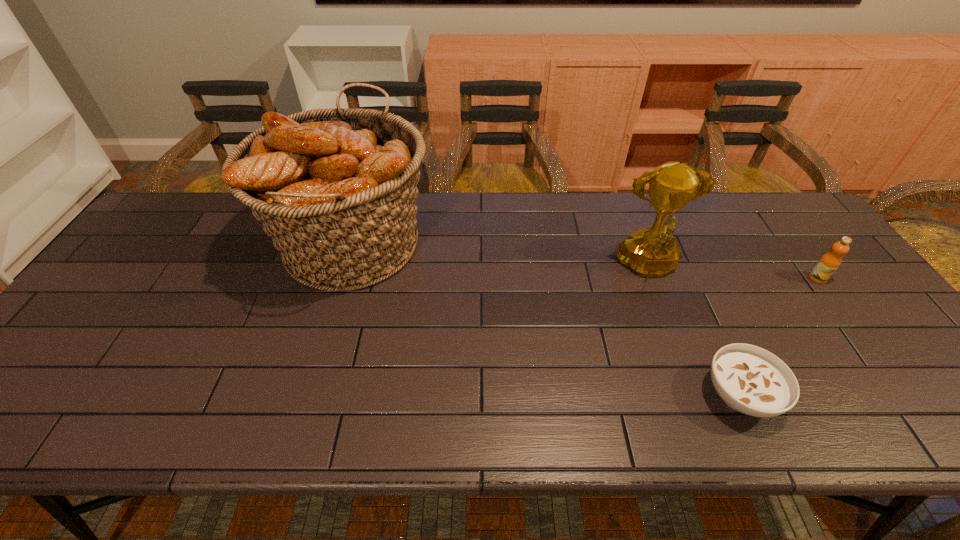
Identify the location of free point between the leftmost object and the orange juice. This screenshot has width=960, height=540. (585, 261).

Locate an element on the screen. Image resolution: width=960 pixels, height=540 pixels. vacant space that is in between the rightmost object and the basket is located at coordinates (585, 261).

At what (x,y) coordinates should I click in order to perform the action: click on vacant space in between the shortest object and the rightmost object. Please return your answer as a coordinate pair (x, y). Looking at the image, I should click on (779, 336).

Where is `vacant space in between the nearest object and the third tallest object`? vacant space in between the nearest object and the third tallest object is located at coordinates (779, 336).

Locate an element on the screen. This screenshot has width=960, height=540. free space between the third shortest object and the soup bowl is located at coordinates (694, 331).

At what (x,y) coordinates should I click in order to perform the action: click on free space between the nearest object and the orange juice. Please return your answer as a coordinate pair (x, y). Looking at the image, I should click on (779, 336).

Locate an element on the screen. The image size is (960, 540). unoccupied position between the soup bowl and the third shortest object is located at coordinates (694, 331).

At what (x,y) coordinates should I click in order to perform the action: click on free space between the third tallest object and the tallest object. Please return your answer as a coordinate pair (x, y). Looking at the image, I should click on point(585,261).

Find the location of a particular element. This screenshot has height=540, width=960. empty space between the award and the nearest object is located at coordinates (694, 331).

Find the location of `the closest object to the soup bowl`. the closest object to the soup bowl is located at coordinates (651, 252).